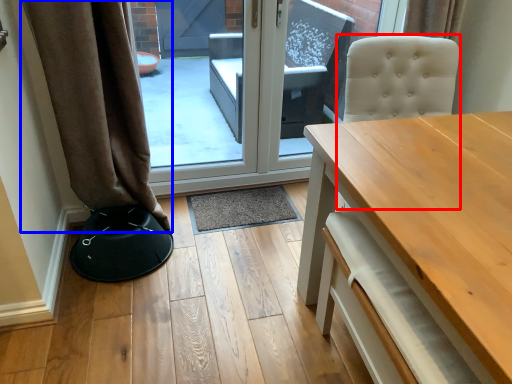
Question: Which object is closer to the camera taking this photo, swivel chair (highlighted by a red box) or curtain (highlighted by a blue box)?

Choices:
 (A) swivel chair
 (B) curtain

Answer: (A)